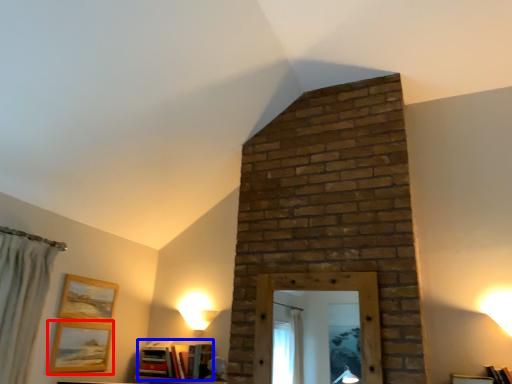
Question: Among these objects, which one is farthest to the camera, picture frame (highlighted by a red box) or book (highlighted by a blue box)?

Choices:
 (A) picture frame
 (B) book

Answer: (B)